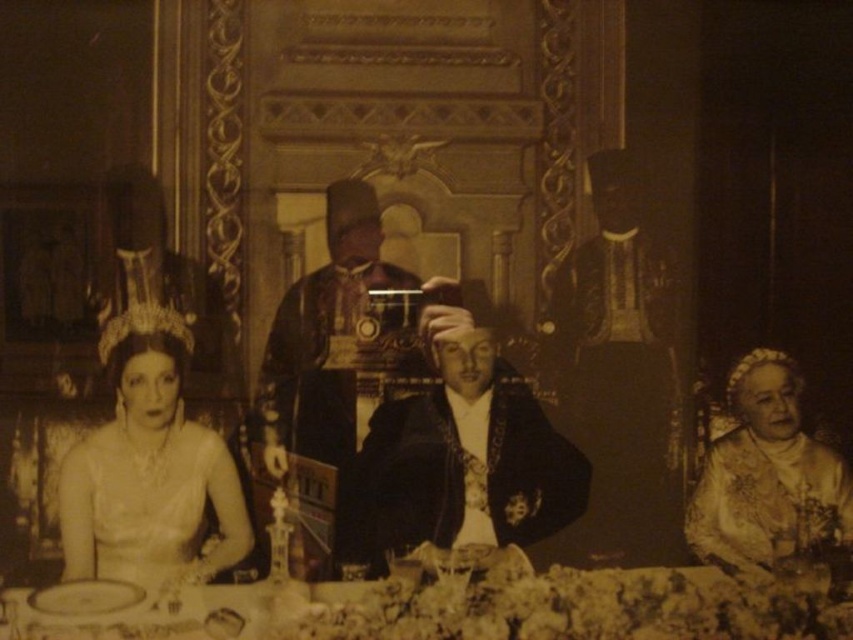
Is point (132, 320) positioned in front of point (801, 468)?

Yes.

Can you confirm if white satin dress at left is wider than gold embroidered dress at center?

Yes, white satin dress at left is wider than gold embroidered dress at center.

This screenshot has height=640, width=853. Find the location of `white satin dress at left`. white satin dress at left is located at coordinates (149, 468).

Does white lace tablecloth at lower center appear over gold embroidered dress at center?

No.

Between point (633, 625) and point (838, 480), which one is positioned behind?

The point (838, 480) is behind.

At what (x,y) coordinates should I click in order to perform the action: click on white lace tablecloth at lower center. Please return your answer as a coordinate pair (x, y). Image resolution: width=853 pixels, height=640 pixels. Looking at the image, I should click on (585, 609).

Is shiny black coat at center smaller than white satin dress at left?

Correct, shiny black coat at center occupies less space than white satin dress at left.

Measure the distance between shiny black coat at center and white satin dress at left.

shiny black coat at center is 7.34 meters away from white satin dress at left.

Does point (405, 419) lie behind point (160, 480)?

Yes, it is.

The image size is (853, 640). Identify the location of shiny black coat at center. (457, 461).